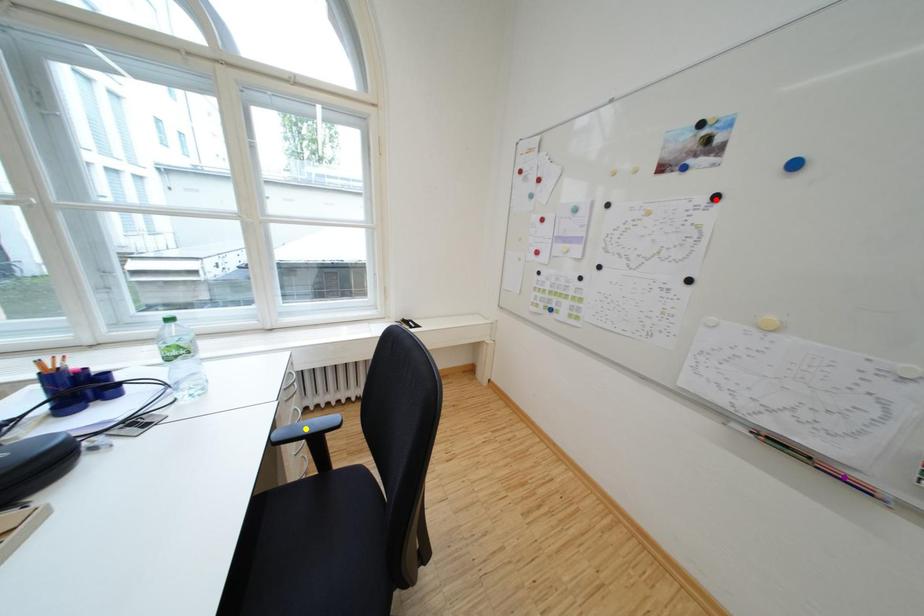
Order these from farthest to nearest:
red point, yellow point, purple point

yellow point → red point → purple point